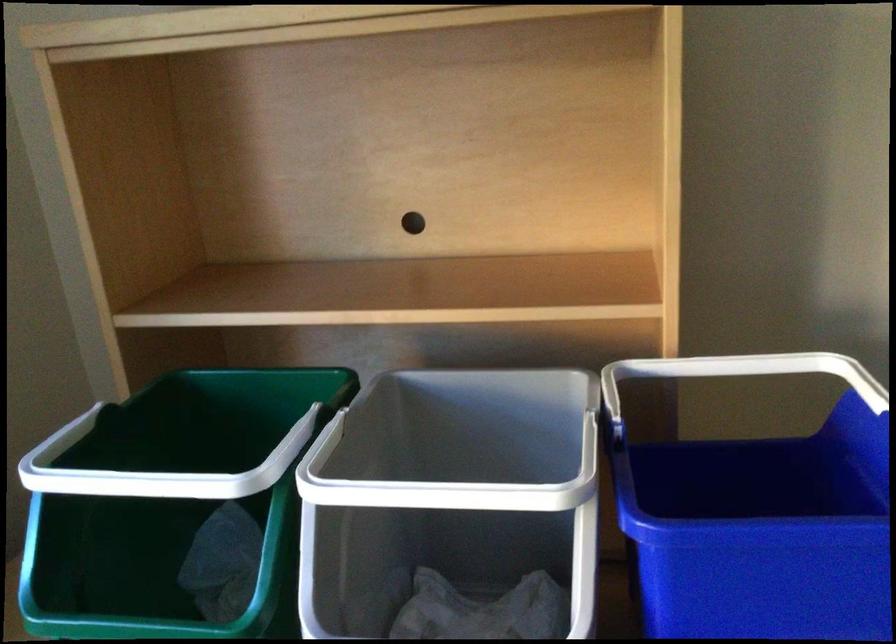
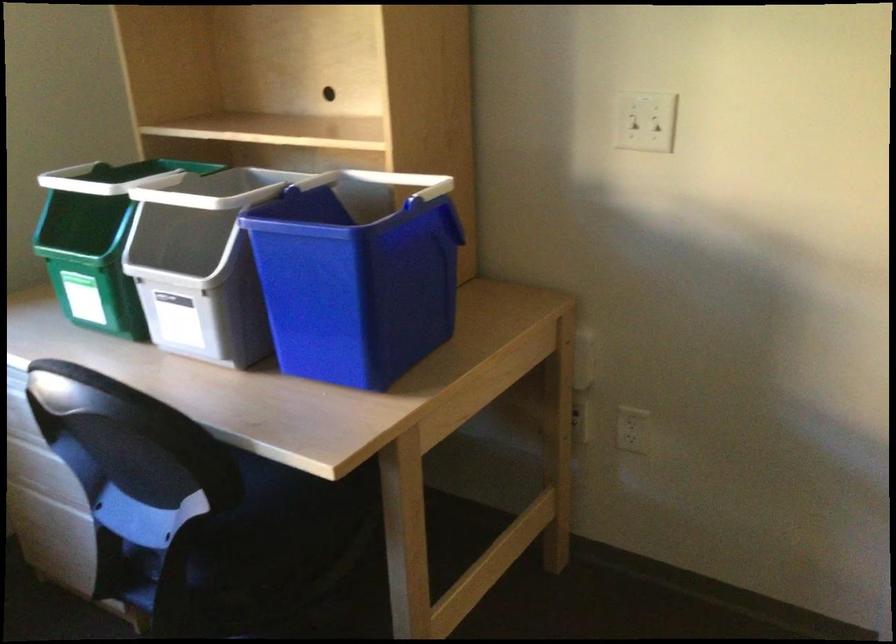
Find the pixel in the second image that matches (722,366) in the first image.

(399, 181)